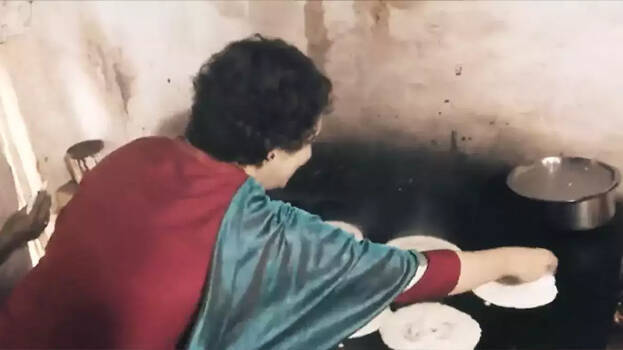
Identify the location of cooking pot. (569, 209).